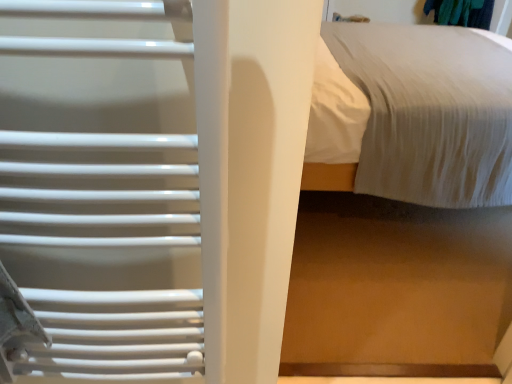
Question: Should I look upward or downward to see white textured bed at upper right, which is the second bed in front-to-back order?

Choices:
 (A) up
 (B) down

Answer: (A)

Question: Which direction should I rotate to look at white textured bed at center, the 2th bed viewed from the back?

Choices:
 (A) right
 (B) left

Answer: (A)

Question: Does white textured bed at center, marked as the 1th bed in a front-to-back arrangement, turn towards white textured bed at upper right, which is the second bed in front-to-back order?

Choices:
 (A) yes
 (B) no

Answer: (B)

Question: Can you confirm if white textured bed at center, marked as the 1th bed in a front-to-back arrangement, is bigger than white textured bed at upper right, which is the second bed in front-to-back order?

Choices:
 (A) no
 (B) yes

Answer: (A)

Question: From the image's perspective, is white textured bed at center, the 2th bed viewed from the back, on top of white textured bed at upper right, which is the second bed in front-to-back order?

Choices:
 (A) no
 (B) yes

Answer: (A)

Question: Considering the relative positions of white textured bed at center, marked as the 1th bed in a front-to-back arrangement, and white textured bed at upper right, which is the second bed in front-to-back order, in the image provided, is white textured bed at center, marked as the 1th bed in a front-to-back arrangement, to the left of white textured bed at upper right, which is the second bed in front-to-back order, from the viewer's perspective?

Choices:
 (A) no
 (B) yes

Answer: (B)

Question: Is white textured bed at upper right, positioned as the first bed in back-to-front order, at the back of white textured bed at center, the 2th bed viewed from the back?

Choices:
 (A) no
 (B) yes

Answer: (B)

Question: Is white textured bed at center, marked as the 1th bed in a front-to-back arrangement, positioned in front of white textured bed at upper right, which is the second bed in front-to-back order?

Choices:
 (A) yes
 (B) no

Answer: (A)

Question: Is white textured bed at upper right, positioned as the first bed in back-to-front order, positioned before white textured bed at center, marked as the 1th bed in a front-to-back arrangement?

Choices:
 (A) no
 (B) yes

Answer: (A)

Question: Is white textured bed at upper right, which is the second bed in front-to-back order, taller than white textured bed at center, the 2th bed viewed from the back?

Choices:
 (A) no
 (B) yes

Answer: (A)

Question: From the image's perspective, is white textured bed at upper right, positioned as the first bed in back-to-front order, beneath white textured bed at center, the 2th bed viewed from the back?

Choices:
 (A) yes
 (B) no

Answer: (B)

Question: Can you confirm if white textured bed at upper right, which is the second bed in front-to-back order, is smaller than white textured bed at center, marked as the 1th bed in a front-to-back arrangement?

Choices:
 (A) no
 (B) yes

Answer: (A)

Question: Is white textured bed at upper right, positioned as the first bed in back-to-front order, further to the viewer compared to white textured bed at center, the 2th bed viewed from the back?

Choices:
 (A) yes
 (B) no

Answer: (A)

Question: Can you confirm if white textured bed at upper right, which is the second bed in front-to-back order, is thinner than white textured bed at center, the 2th bed viewed from the back?

Choices:
 (A) yes
 (B) no

Answer: (B)

Question: Does white matte radiator at left appear on the right side of white textured bed at upper right, which is the second bed in front-to-back order?

Choices:
 (A) yes
 (B) no

Answer: (B)